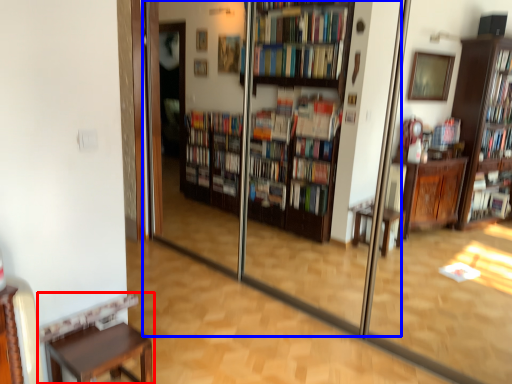
Question: Among these objects, which one is nearest to the camera, furniture (highlighted by a red box) or screen door (highlighted by a blue box)?

Choices:
 (A) furniture
 (B) screen door

Answer: (B)